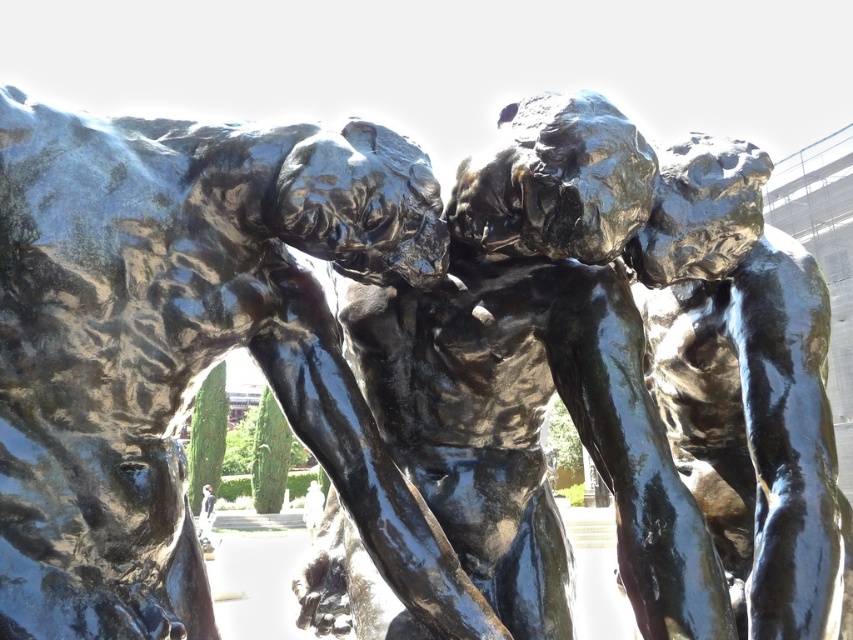
Is shiny black sculpture at center above glossy bronze statue at center?

Indeed, shiny black sculpture at center is positioned over glossy bronze statue at center.

Which is in front, point (303, 150) or point (558, 529)?

Point (303, 150) is in front.

This screenshot has height=640, width=853. I want to click on shiny black sculpture at center, so click(x=189, y=352).

Measure the distance between shiny black sculpture at center and shiny bronze torso at center.

shiny black sculpture at center and shiny bronze torso at center are 27.14 inches apart.

Who is positioned more to the left, shiny black sculpture at center or shiny bronze torso at center?

Positioned to the left is shiny black sculpture at center.

Who is more forward, (51, 332) or (795, 595)?

Point (51, 332) is more forward.

At what (x,y) coordinates should I click in order to perform the action: click on shiny black sculpture at center. Please return your answer as a coordinate pair (x, y). This screenshot has height=640, width=853. Looking at the image, I should click on (189, 352).

Is glossy bronze statue at center thinner than shiny bronze torso at center?

No.

Can you confirm if glossy bronze statue at center is shorter than shiny bronze torso at center?

Correct, glossy bronze statue at center is not as tall as shiny bronze torso at center.

Is point (611, 220) less distant than point (721, 429)?

Yes, it is.

The height and width of the screenshot is (640, 853). In order to click on glossy bronze statue at center in this screenshot , I will do `click(538, 376)`.